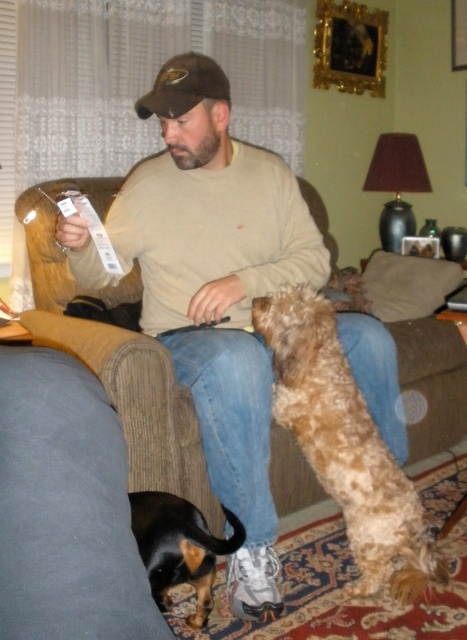
Question: Among these objects, which one is farthest from the camera?

Choices:
 (A) fuzzy brown dog at center
 (B) beige sweater at center
 (C) black and tan fur at lower left
 (D) black leather dog at lower left

Answer: (A)

Question: Is the position of beige sweater at center less distant than that of fuzzy brown dog at center?

Choices:
 (A) yes
 (B) no

Answer: (A)

Question: Among these points, which one is nearest to the camera?

Choices:
 (A) (197, 612)
 (B) (73, 609)
 (C) (227, 308)

Answer: (B)

Question: Does fuzzy brown dog at center have a lesser width compared to brown fabric baseball cap at center?

Choices:
 (A) yes
 (B) no

Answer: (B)

Question: Does beige sweater at center have a lesser width compared to black leather dog at lower left?

Choices:
 (A) no
 (B) yes

Answer: (A)

Question: Which is nearer to the fuzzy brown dog at center?

Choices:
 (A) beige sweater at center
 (B) black and tan fur at lower left

Answer: (A)